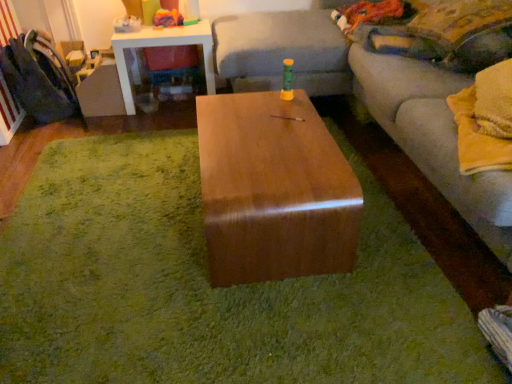
Question: Would you say velvet yellow pillow at upper right is to the left or to the right of brown glossy wood table at center in the picture?

Choices:
 (A) left
 (B) right

Answer: (B)

Question: Is velvet yellow pillow at upper right spatially inside brown glossy wood table at center, or outside of it?

Choices:
 (A) outside
 (B) inside

Answer: (A)

Question: Estimate the real-world distances between objects in this image. Which object is farther from the white glossy side table at upper left?

Choices:
 (A) velvet yellow pillow at upper right
 (B) rubberized plastic toy at upper left
 (C) shiny brown wood coffee table at center
 (D) matte gray couch at center
 (E) brown glossy wood table at center

Answer: (A)

Question: Which is nearer to the rubberized plastic toy at upper left?

Choices:
 (A) matte gray couch at center
 (B) velvet yellow pillow at upper right
 (C) velvet dark blue swivel chair at left
 (D) white glossy side table at upper left
 (E) shiny brown wood coffee table at center

Answer: (D)